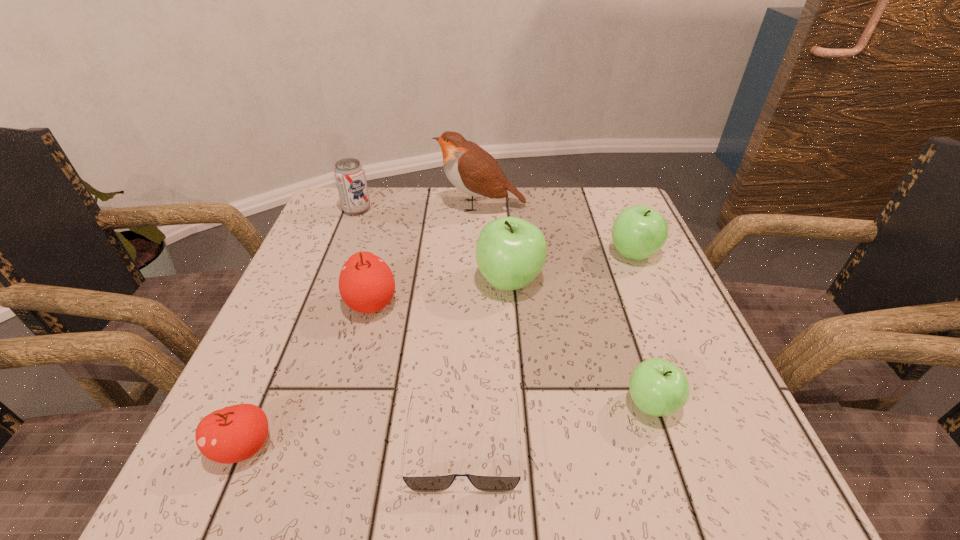
Locate an element on the screen. This screenshot has height=540, width=960. free space located 0.190m on the back of the left red apple is located at coordinates click(x=294, y=330).

Identify the location of bird present at the far edge. This screenshot has width=960, height=540. (471, 169).

Identify the location of beer can that is at the far edge. This screenshot has width=960, height=540. (349, 174).

This screenshot has height=540, width=960. What are the coordinates of `apple at the far edge` in the screenshot? It's located at (638, 232).

You are a GUI agent. You are given a task and a screenshot of the screen. Output one action in this format:
    pyautogui.click(x=<x>, y=<y>)
    Task: Click on the apple situated at the near edge
    The image size is (960, 540).
    Given the screenshot: What is the action you would take?
    pyautogui.click(x=235, y=433)

You are a GUI agent. You are given a task and a screenshot of the screen. Output one action in this format:
    pyautogui.click(x=<x>, y=<y>)
    Task: Click on the sunglasses positioned at the near edge
    
    Given the screenshot: What is the action you would take?
    pyautogui.click(x=420, y=483)

Where is `beer can positioned at the left edge`? Image resolution: width=960 pixels, height=540 pixels. beer can positioned at the left edge is located at coordinates (349, 174).

You are a GUI agent. You are given a task and a screenshot of the screen. Output one action in this format:
    pyautogui.click(x=<x>, y=<y>)
    Task: Click on the object that is positioned at the far left corner
    
    Given the screenshot: What is the action you would take?
    pyautogui.click(x=349, y=174)

Identify the location of object that is at the near left corner. This screenshot has height=540, width=960. (235, 433).

I want to click on object present at the far right corner, so click(x=638, y=232).